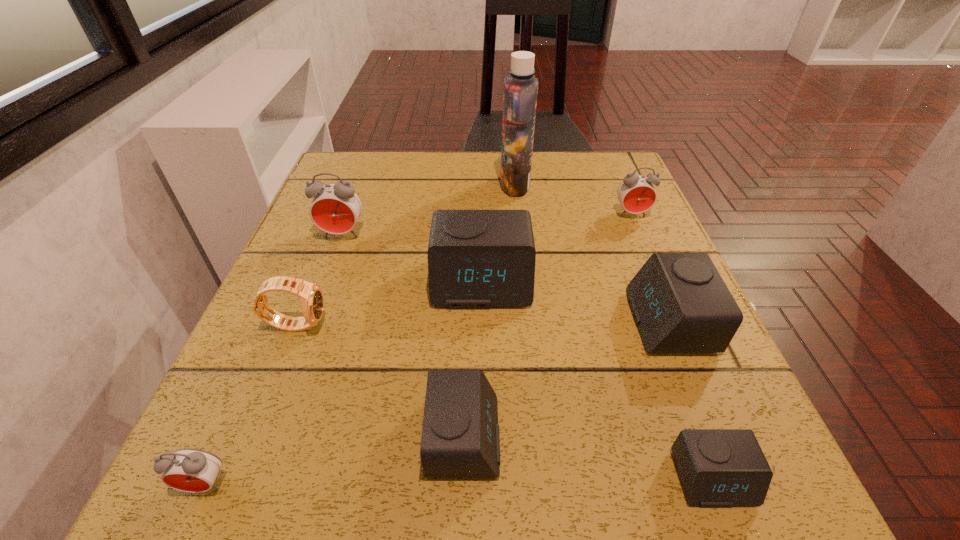
The image size is (960, 540). What are the coordinates of `the third biggest black alarm clock` in the screenshot? It's located at (460, 437).

This screenshot has width=960, height=540. I want to click on the shortest object, so click(718, 467).

Find the location of a particular element. The height and width of the screenshot is (540, 960). the shortest alarm clock is located at coordinates (718, 467).

Locate an element on the screen. vacant space located on the front label of the farthest object is located at coordinates (446, 185).

At what (x,y) coordinates should I click in order to perform the action: click on free space located on the front label of the farthest object. Please return your answer as a coordinate pair (x, y). This screenshot has width=960, height=540. Looking at the image, I should click on (361, 185).

Identify the location of vacant region located on the front label of the farthest object. (345, 185).

Locate an element on the screen. The height and width of the screenshot is (540, 960). free space located 0.070m on the face of the tallest alarm clock is located at coordinates [x=331, y=265].

Locate an element on the screen. vacant point located on the face of the farthest red alarm clock is located at coordinates (679, 323).

Locate an element on the screen. This screenshot has width=960, height=540. vacant space situated 0.050m on the front-facing side of the biggest black alarm clock is located at coordinates (482, 332).

Find the location of a particular element. free space located 0.220m on the face of the black watch is located at coordinates (455, 324).